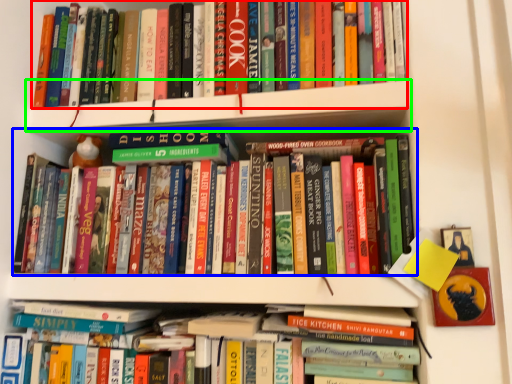
Question: Considering the real-world distances, which object is closest to book (highlighted by a red box)? book (highlighted by a blue box) or shelf (highlighted by a green box).

Choices:
 (A) book
 (B) shelf

Answer: (B)